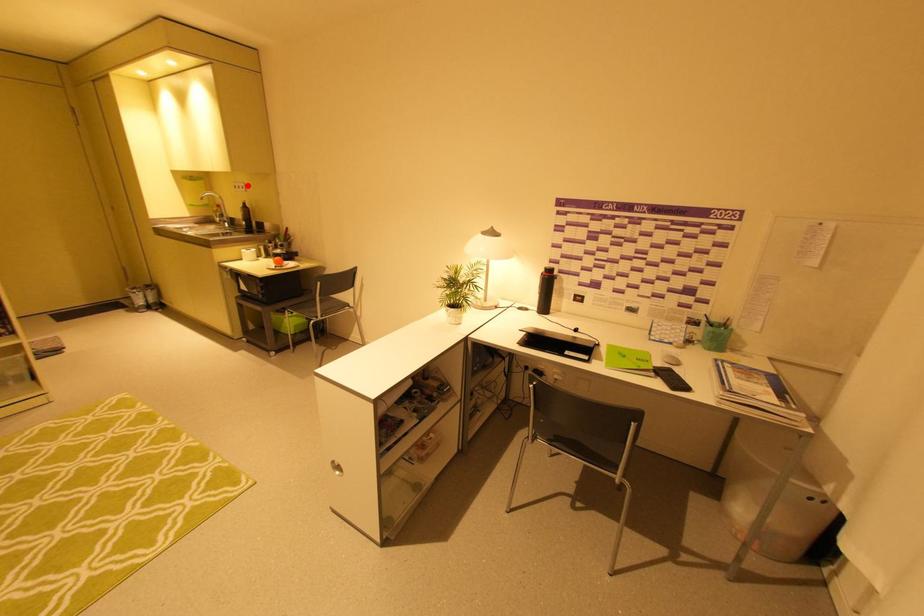
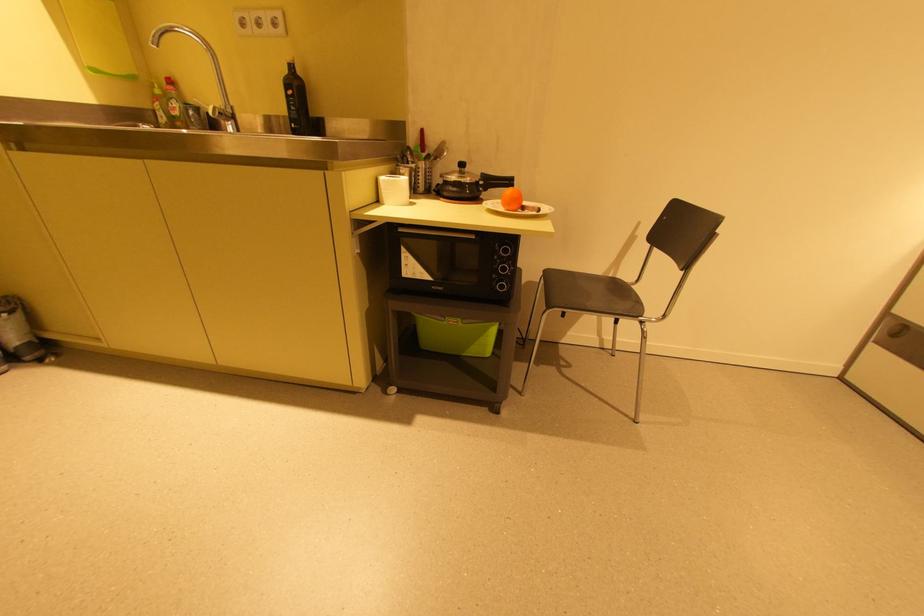
The point at the highlighted location is marked in the first image. Where is the corresponding point in the second image?

(284, 15)